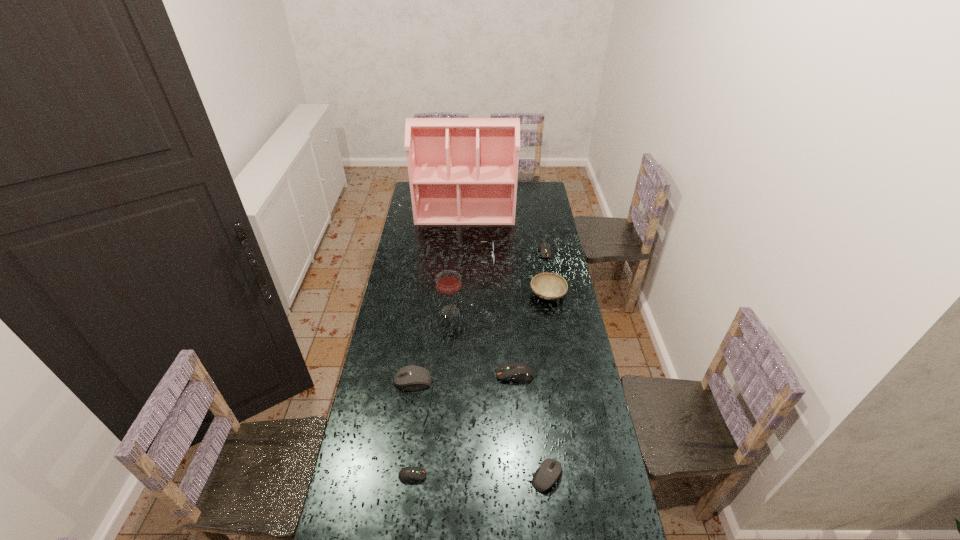
This screenshot has height=540, width=960. Find the location of `vacant space located on the button of the second farthest dark computer equipment`. vacant space located on the button of the second farthest dark computer equipment is located at coordinates (423, 375).

Locate an element on the screen. The image size is (960, 540). free space located on the button of the second farthest dark computer equipment is located at coordinates (423, 375).

At what (x,y) coordinates should I click in order to perform the action: click on free space located 0.220m on the button of the second farthest dark computer equipment. Please return your answer as a coordinate pair (x, y). Looking at the image, I should click on (442, 375).

The width and height of the screenshot is (960, 540). In order to click on vacant area located on the front of the left black computer equipment in this screenshot , I will do `click(410, 403)`.

At what (x,y) coordinates should I click in order to perform the action: click on free region located 0.100m on the button of the rightmost dark computer equipment. Please return your answer as a coordinate pair (x, y). This screenshot has width=960, height=540. Looking at the image, I should click on (548, 272).

Identify the location of vacant space situated 0.330m on the back of the nearer black computer equipment. (536, 380).

I want to click on free space located 0.250m on the button of the leftmost dark computer equipment, so click(502, 476).

At what (x,y) coordinates should I click in order to perform the action: click on object at the far edge. Please return your answer as a coordinate pair (x, y). Image resolution: width=960 pixels, height=540 pixels. Looking at the image, I should click on (462, 171).

Find the location of a particular element. Image resolution: width=960 pixels, height=540 pixels. dollhouse present at the left edge is located at coordinates (462, 171).

Identify the location of computer equipment located at the left edge. (413, 377).